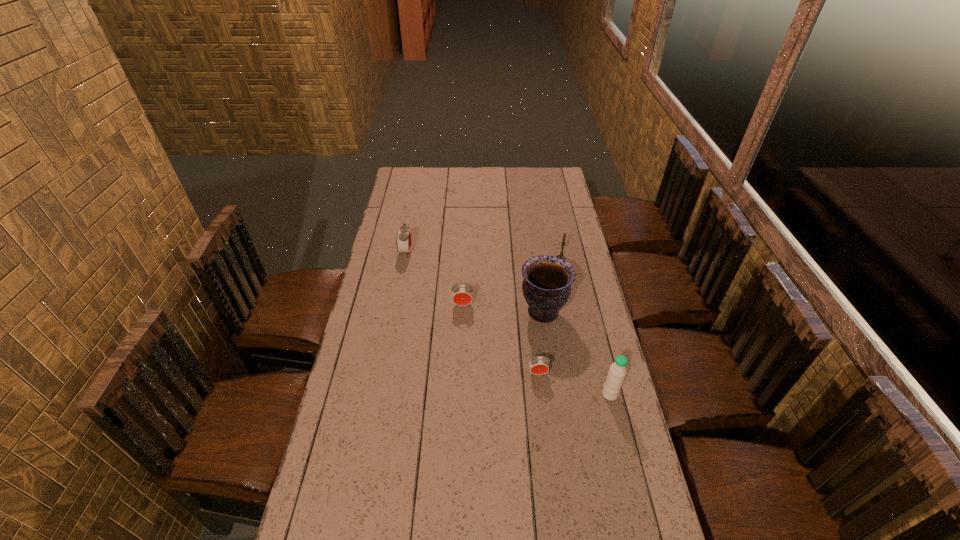
Please point a spot on the right to add another alarm clock. Please provide its 2D coordinates. Your answer should be formatted as a tuple, i.e. [(x, y)], where the tuple contains the x and y coordinates of a point satisfying the conditions above.

[(640, 466)]